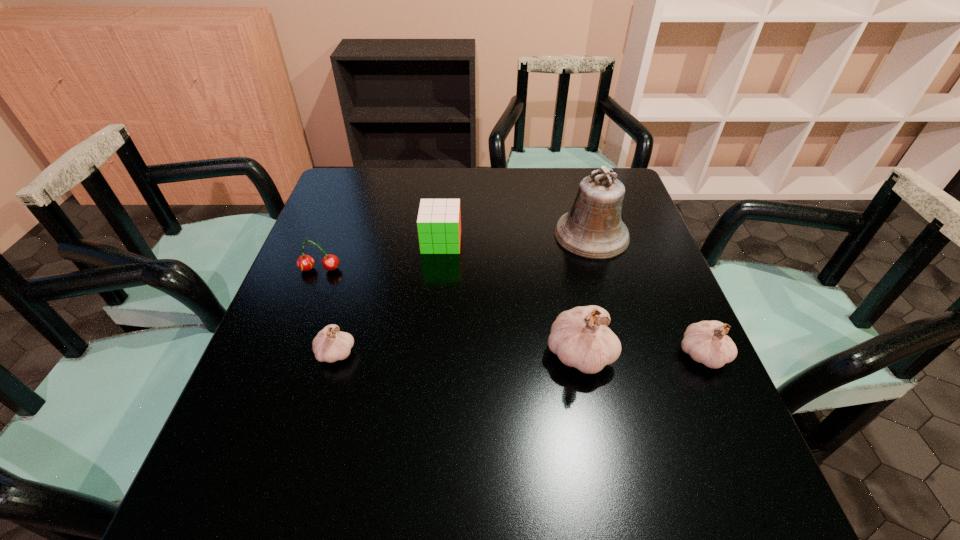
If equal spacing is the goal by inserting an additional garlic among them, please point out a vacant space for this new garlic. Please provide its 2D coordinates. Your answer should be formatted as a tuple, i.e. [(x, y)], where the tuple contains the x and y coordinates of a point satisfying the conditions above.

[(458, 353)]